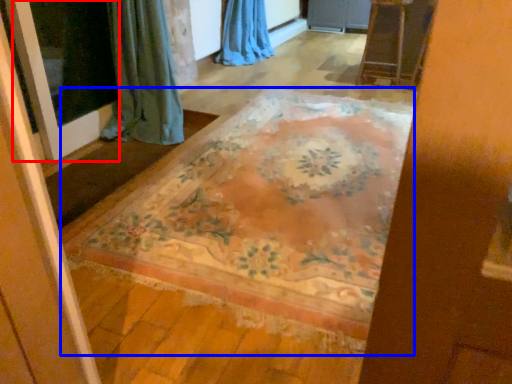
Question: Which object appears farthest to the camera in this image, screen door (highlighted by a red box) or mat (highlighted by a blue box)?

Choices:
 (A) screen door
 (B) mat

Answer: (A)